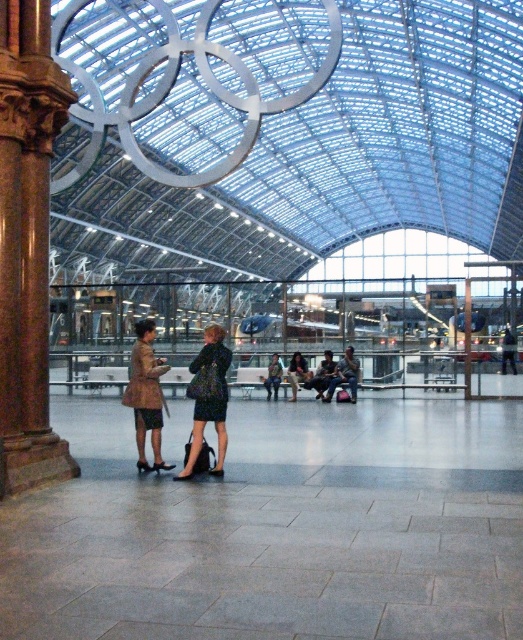
Question: Can you confirm if brown stone column at left is wider than camouflage fabric jacket at center?

Choices:
 (A) yes
 (B) no

Answer: (B)

Question: Which object appears farthest from the camera in this image?

Choices:
 (A) dark blue fabric jacket at center
 (B) dark blue jeans at center
 (C) dark blue fabric coat at center

Answer: (A)

Question: Among these points, which one is farthest from the camera?

Choices:
 (A) (272, 369)
 (B) (322, 364)
 (C) (2, 225)

Answer: (A)

Question: Considering the relative positions of brown stone column at left and dark blue jeans at center in the image provided, where is brown stone column at left located with respect to dark blue jeans at center?

Choices:
 (A) left
 (B) right

Answer: (A)

Question: Is dark blue fabric coat at center above leather jacket at center?

Choices:
 (A) no
 (B) yes

Answer: (B)

Question: Considering the real-world distances, which object is farthest from the dark blue jeans at center?

Choices:
 (A) brown leather jacket at center
 (B) leather jacket at center
 (C) brown stone column at left

Answer: (C)